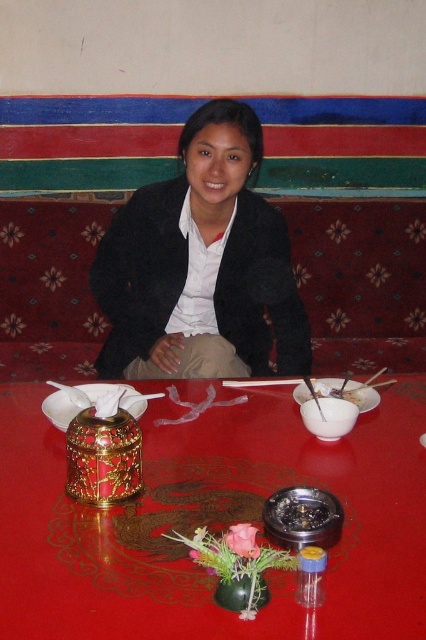
Question: Among these points, which one is farthest from the camera?

Choices:
 (A) (259, 384)
 (B) (245, 285)
 (C) (241, 456)

Answer: (B)

Question: Considering the relative positions of white matte bowl at center and wooden chopsticks at center in the image provided, where is white matte bowl at center located with respect to wooden chopsticks at center?

Choices:
 (A) below
 (B) above

Answer: (A)

Question: Which is nearer to the white matte bowl at center?

Choices:
 (A) wooden chopsticks at center
 (B) shiny red table at center
 (C) black matte jacket at center

Answer: (A)

Question: Is white matte bowl at center positioned at the back of wooden chopsticks at center?

Choices:
 (A) yes
 (B) no

Answer: (B)

Question: Which of the following is the closest to the observer?

Choices:
 (A) (288, 324)
 (B) (316, 381)
 (C) (112, 508)
 (D) (245, 387)

Answer: (C)

Question: Can you confirm if white matte bowl at center is positioned below wooden chopsticks at center?

Choices:
 (A) no
 (B) yes

Answer: (B)